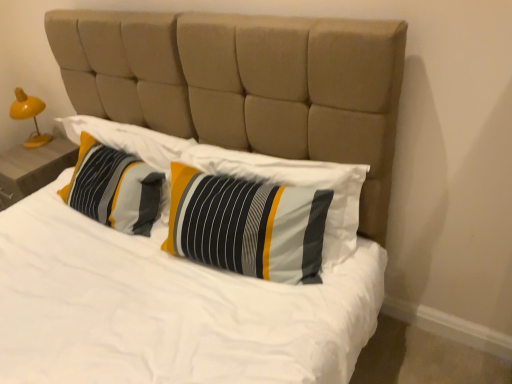
Where is `free location in front of yellow plastic lamp at left`? free location in front of yellow plastic lamp at left is located at coordinates (39, 152).